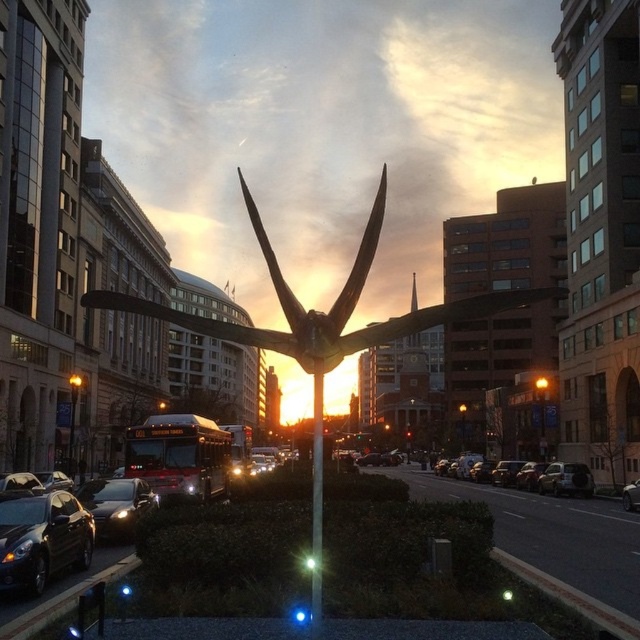
Question: From the image, what is the correct spatial relationship of silver metallic sedan at center in relation to shiny silver car at center?

Choices:
 (A) right
 (B) left

Answer: (A)

Question: Which point is farther to the camera?

Choices:
 (A) (554, 492)
 (B) (636, 486)
 (C) (125, 488)
 (D) (314, 588)

Answer: (A)

Question: Can you confirm if shiny black sedan at lower left is thinner than shiny black sedan at center-left?

Choices:
 (A) no
 (B) yes

Answer: (A)

Question: Does shiny black sedan at center-left appear on the left side of silver metallic sedan at center?

Choices:
 (A) yes
 (B) no

Answer: (A)

Question: Estimate the real-world distances between objects in this image. Which object is closer to the shiny black sedan at center-left?

Choices:
 (A) silver metallic sedan at center
 (B) polished bronze sculpture at center
 (C) metallic pole at center

Answer: (C)

Question: Which point is closer to the camera?

Choices:
 (A) shiny silver car at center
 (B) metallic pole at center
 (C) shiny black sedan at lower left

Answer: (B)